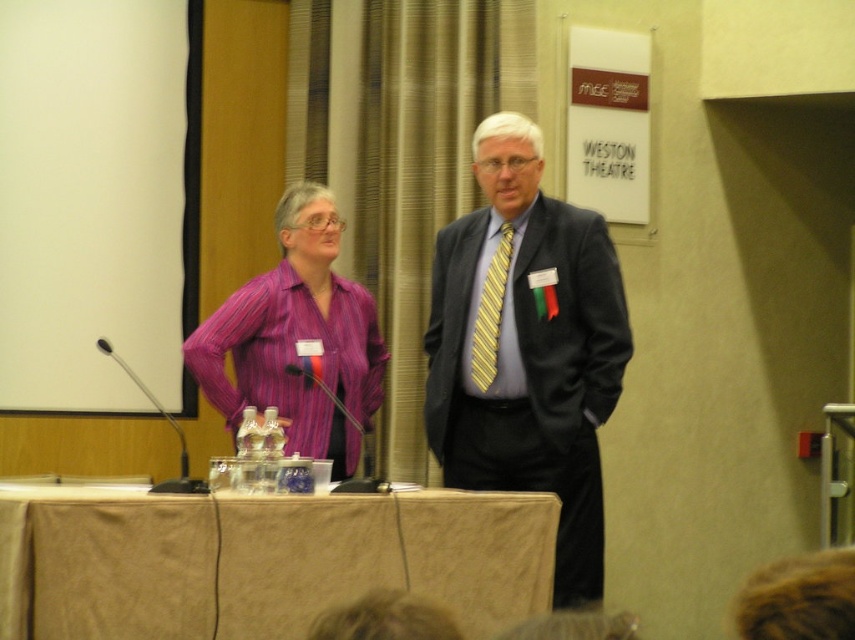
Is point (458, 301) closer to viewer compared to point (298, 440)?

Yes, it is in front of point (298, 440).

This screenshot has height=640, width=855. What do you see at coordinates (526, 348) in the screenshot?
I see `matte black suit at center` at bounding box center [526, 348].

Locate an element on the screen. matte black suit at center is located at coordinates pos(526,348).

How much distance is there between beige fabric table at lower center and yellow striped tie at center?

36.34 inches

Is beige fabric table at lower center further to camera compared to yellow striped tie at center?

No, it is not.

The width and height of the screenshot is (855, 640). What do you see at coordinates (263, 561) in the screenshot? I see `beige fabric table at lower center` at bounding box center [263, 561].

Find the location of a particular element. The width and height of the screenshot is (855, 640). beige fabric table at lower center is located at coordinates (263, 561).

Does matte black suit at center have a lesser width compared to yellow striped tie at center?

In fact, matte black suit at center might be wider than yellow striped tie at center.

Is matte black suit at center shorter than yellow striped tie at center?

No.

Who is more forward, (534, 374) or (506, 227)?

Point (534, 374) is in front.

This screenshot has height=640, width=855. Find the location of `matte black suit at center`. matte black suit at center is located at coordinates (526, 348).